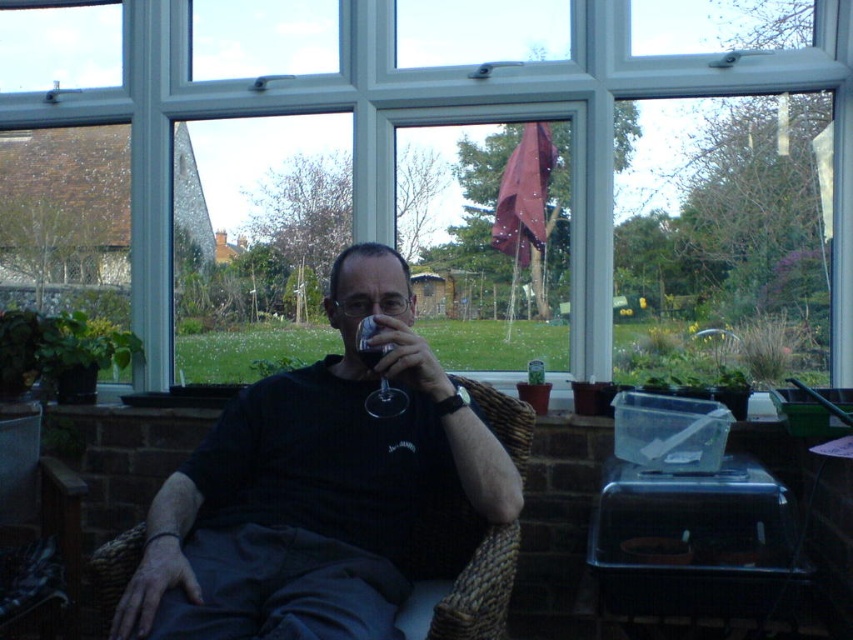
You are a delivery robot with a height of 1.5 meters. You are approaching the transparent glass at center. Can you pass under it without bending?

The distance between the transparent glass at center and the viewer is 1.64 meters. Since the robot is 1.5 meters tall, it can pass under the transparent glass at center without bending as the height clearance is sufficient.

You are a person who is 1.7 meters tall. You are sitting in the brown woven armchair at lower left and want to reach the translucent glass wine at center. Can you comfortably reach it without standing up?

The brown woven armchair at lower left is much taller than the translucent glass wine at center, so you can comfortably reach it without standing up because the wine is lower than the chair.

You are a guest at this sunroom and want to grab the translucent glass wine at center without touching the transparent glass at center. Is this possible?

The transparent glass at center is below the translucent glass wine at center, so you can reach the translucent glass wine at center carefully without touching the transparent glass at center.